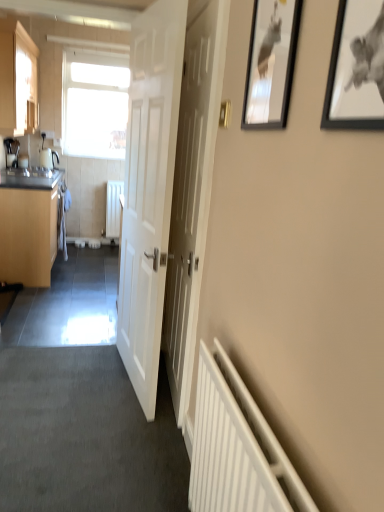
Question: From a real-world perspective, is black glossy picture frame at upper right, which is the 2th picture frame in front-to-back order, located beneath white matte radiator at center, which is the second radiator in front-to-back order?

Choices:
 (A) yes
 (B) no

Answer: (B)

Question: From a real-world perspective, is black glossy picture frame at upper right, the 1th picture frame positioned from the left, located higher than white matte radiator at center, which is the 1th radiator from top to bottom?

Choices:
 (A) yes
 (B) no

Answer: (A)

Question: Considering the relative sizes of black glossy picture frame at upper right, the second picture frame in the right-to-left sequence, and white matte radiator at center, positioned as the 1th radiator in back-to-front order, in the image provided, is black glossy picture frame at upper right, the second picture frame in the right-to-left sequence, taller than white matte radiator at center, positioned as the 1th radiator in back-to-front order,?

Choices:
 (A) no
 (B) yes

Answer: (A)

Question: From the image's perspective, is black glossy picture frame at upper right, the second picture frame in the right-to-left sequence, below white matte radiator at center, which is the 1th radiator from top to bottom?

Choices:
 (A) no
 (B) yes

Answer: (A)

Question: Is black glossy picture frame at upper right, the 1th picture frame positioned from the left, looking in the opposite direction of white matte radiator at center, positioned as the 1th radiator in back-to-front order?

Choices:
 (A) no
 (B) yes

Answer: (A)

Question: In the image, is white matte radiator at lower right, acting as the second radiator starting from the top, on the left side or the right side of transparent glass window at upper left?

Choices:
 (A) left
 (B) right

Answer: (B)

Question: Is white matte radiator at lower right, positioned as the first radiator in right-to-left order, wider or thinner than transparent glass window at upper left?

Choices:
 (A) thin
 (B) wide

Answer: (B)

Question: Considering the positions of white matte radiator at lower right, the 2th radiator in the back-to-front sequence, and transparent glass window at upper left in the image, is white matte radiator at lower right, the 2th radiator in the back-to-front sequence, taller or shorter than transparent glass window at upper left?

Choices:
 (A) tall
 (B) short

Answer: (B)

Question: From a real-world perspective, is white matte radiator at lower right, the 2th radiator in the back-to-front sequence, above or below transparent glass window at upper left?

Choices:
 (A) above
 (B) below

Answer: (B)

Question: From the image's perspective, is transparent glass window at upper left positioned above or below white matte radiator at center, which is the second radiator in front-to-back order?

Choices:
 (A) below
 (B) above

Answer: (B)

Question: Considering their positions, is transparent glass window at upper left located in front of or behind white matte radiator at center, the 2th radiator when ordered from bottom to top?

Choices:
 (A) behind
 (B) front

Answer: (B)

Question: Is transparent glass window at upper left taller or shorter than white matte radiator at center, which is the 1th radiator from top to bottom?

Choices:
 (A) short
 (B) tall

Answer: (B)

Question: Looking at the image, does transparent glass window at upper left seem bigger or smaller compared to white matte radiator at center, which is the 1th radiator from top to bottom?

Choices:
 (A) big
 (B) small

Answer: (A)

Question: Considering the positions of black glossy picture frame at upper right, which appears as the first picture frame when viewed from the back, and white wooden door at center, which is the first door from left to right, in the image, is black glossy picture frame at upper right, which appears as the first picture frame when viewed from the back, taller or shorter than white wooden door at center, which is the first door from left to right,?

Choices:
 (A) tall
 (B) short

Answer: (B)

Question: Is black glossy picture frame at upper right, the second picture frame in the right-to-left sequence, in front of or behind white wooden door at center, which is the first door from left to right, in the image?

Choices:
 (A) front
 (B) behind

Answer: (A)